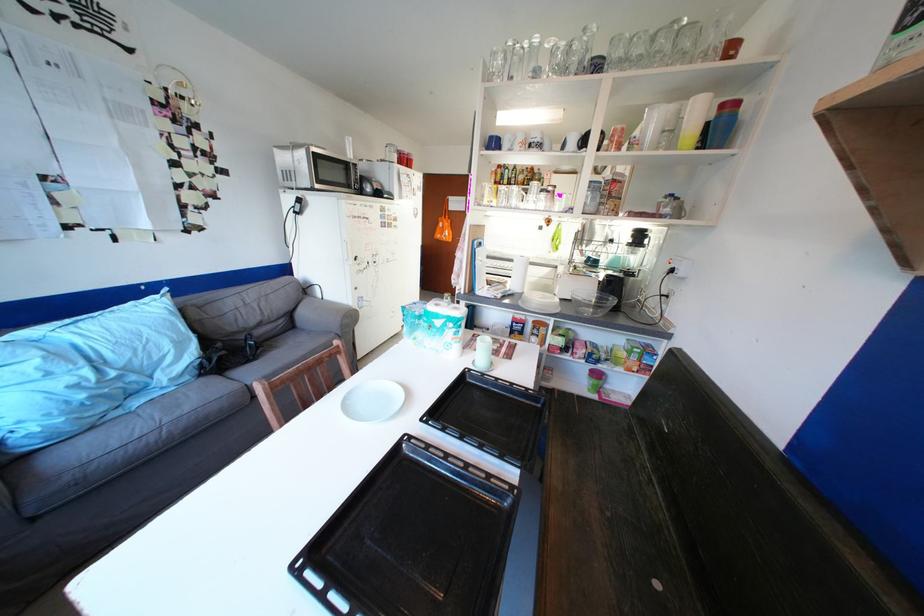
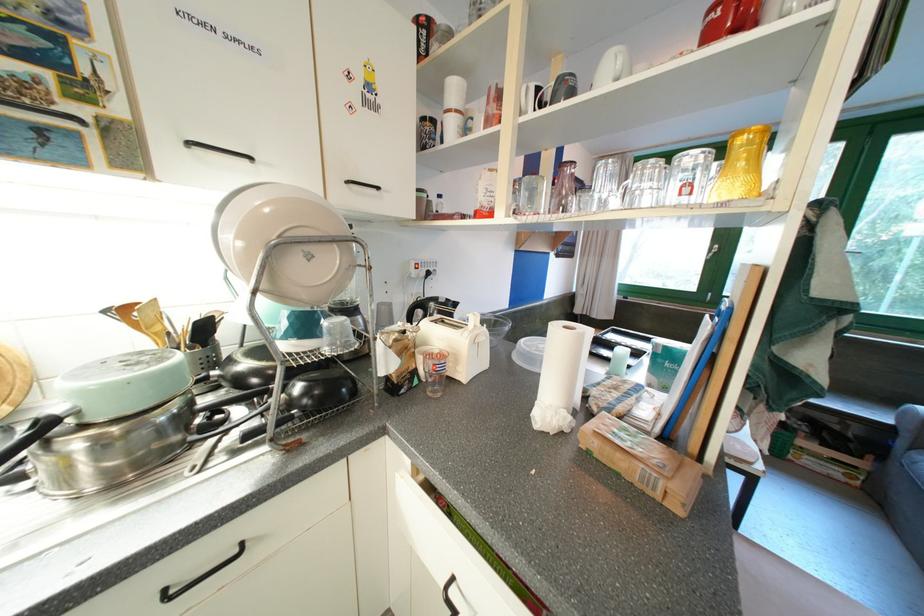
Question: I am providing you with two images of the same scene from different viewpoints. After the viewpoint changes to image2, which objects are now occluded?

Choices:
 (A) pot lid handle
 (B) round white button
 (C) black baking tray
 (D) white mug handle

Answer: (C)